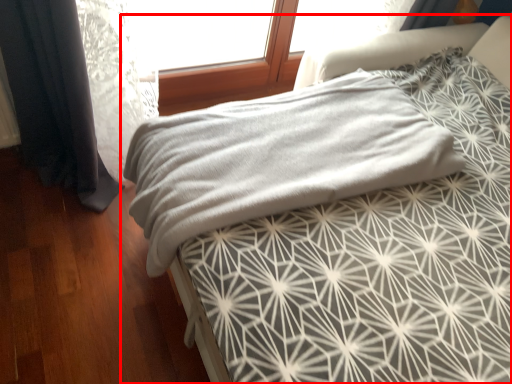
Question: From the image's perspective, considering the relative positions of bed (annotated by the red box) and blanket in the image provided, where is bed (annotated by the red box) located with respect to the staircase?

Choices:
 (A) above
 (B) below

Answer: (A)